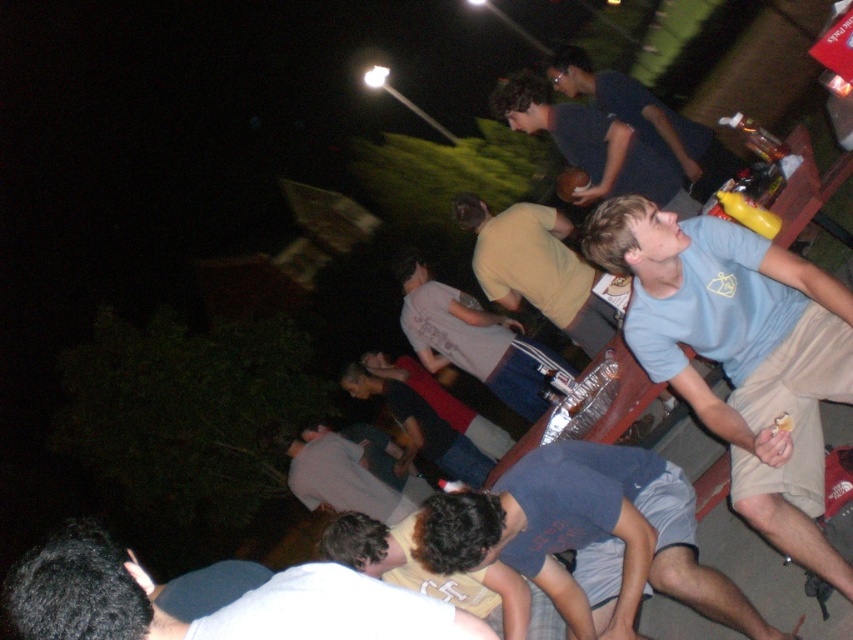
Does dark brown hair at lower left have a lesser height compared to light yellow t-shirt at center?

Indeed, dark brown hair at lower left has a lesser height compared to light yellow t-shirt at center.

Can you confirm if dark brown hair at lower left is positioned below light yellow t-shirt at center?

Yes.

What are the coordinates of `dark brown hair at lower left` in the screenshot? It's located at (216, 609).

Between light blue t-shirt at upper right and dark blue shorts at lower center, which one appears on the left side from the viewer's perspective?

From the viewer's perspective, dark blue shorts at lower center appears more on the left side.

Which is behind, point (708, 241) or point (532, 538)?

Positioned behind is point (532, 538).

What do you see at coordinates (740, 355) in the screenshot?
I see `light blue t-shirt at upper right` at bounding box center [740, 355].

I want to click on light blue t-shirt at upper right, so click(x=740, y=355).

Between point (782, 292) and point (415, 410), which one is positioned in front?

Point (782, 292)

Which is behind, point (720, 419) or point (422, 456)?

Point (422, 456)

Which is in front, point (788, 332) or point (456, 464)?

Positioned in front is point (788, 332).

The width and height of the screenshot is (853, 640). I want to click on light blue t-shirt at upper right, so click(x=740, y=355).